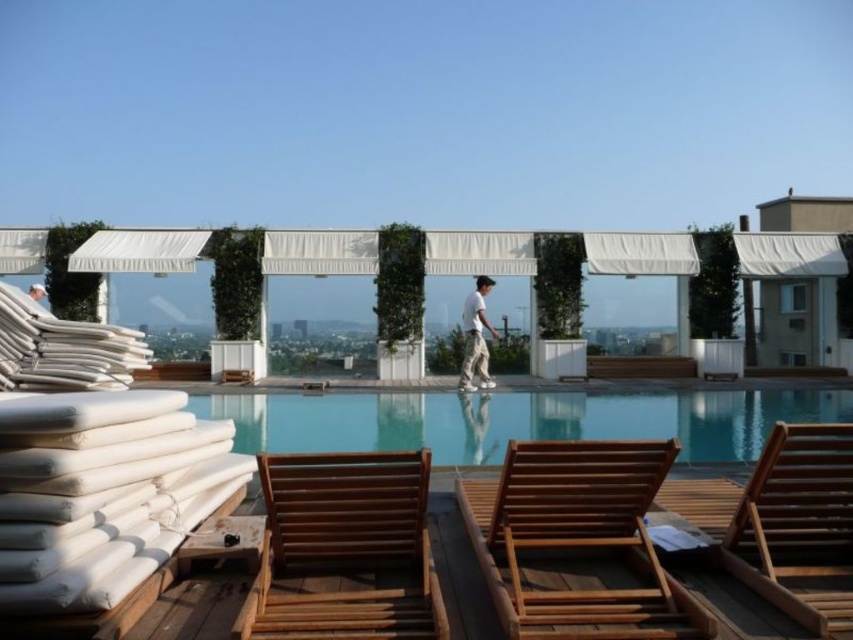
You are standing on the rooftop deck and want to place your white cotton pants at center on the clear glass pool at center. Is this possible based on their positions?

The clear glass pool at center is below the white cotton pants at center, so placing the white cotton pants at center onto the clear glass pool at center is possible since the pants are positioned above the pool.

You are planning to place a rectangular wooden bench that is 2 meters wide between the wooden lounge chair at center and the clear glass pool at center. Based on the scene description, will the bench fit between them without overlapping either object?

The wooden lounge chair at center has a lesser width compared to clear glass pool at center. Since the bench is 2 meters wide, and the space between the two objects must accommodate the bench without overlapping, the answer depends on whether the distance between the edges of the two objects is at least 2 meters. However, the provided information only states the relative widths of the objects, not the distance between them. Therefore, it is impossible to determine if the bench will fit based solely on the

You are standing at the edge of the rooftop pool and want to place a new lounge chair exactly where the wooden lounge chair at center is currently located. What are the coordinates where you should position the new lounge chair?

The coordinates for the wooden lounge chair at center are at point (x=577, y=541), so you should position the new lounge chair at those exact coordinates.